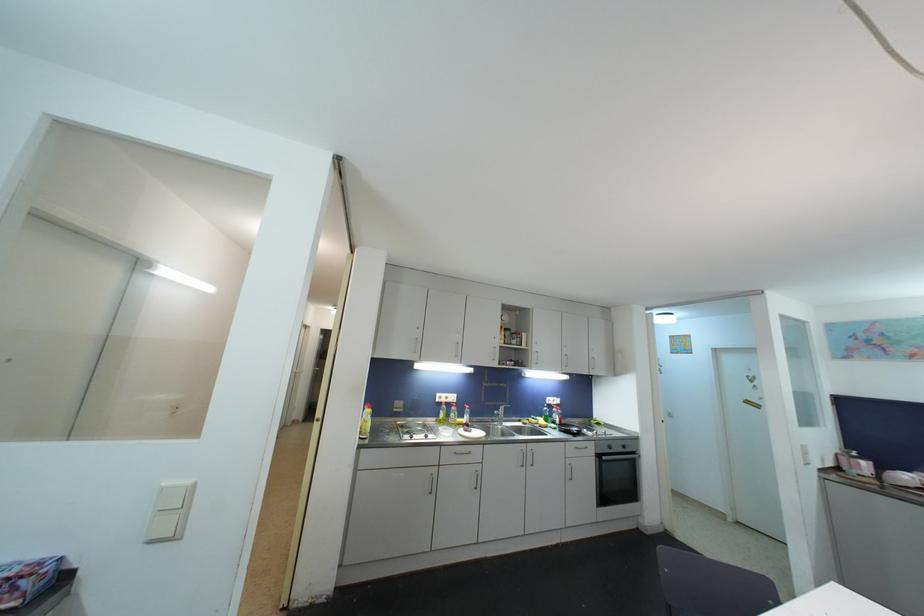
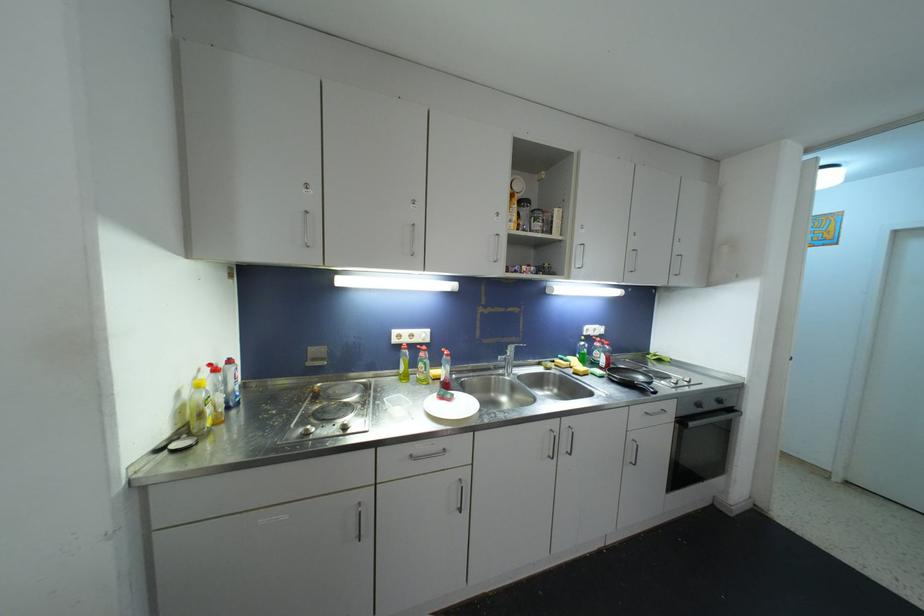
Question: The images are taken continuously from a first-person perspective. In which direction are you moving?

Choices:
 (A) Left
 (B) Right
 (C) Forward
 (D) Backward

Answer: (C)